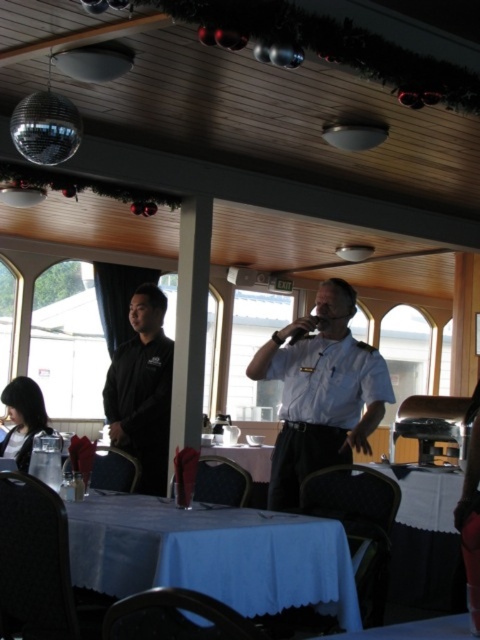
Question: Does blue fabric table at lower center appear on the left side of black smooth shirt at left?

Choices:
 (A) no
 (B) yes

Answer: (A)

Question: Which object appears farthest from the camera in this image?

Choices:
 (A) white uniform at center
 (B) black smooth shirt at left
 (C) blue fabric table at lower center

Answer: (B)

Question: Which of the following is the farthest from the observer?

Choices:
 (A) (315, 316)
 (B) (199, 592)

Answer: (A)

Question: Can you confirm if blue fabric table at lower center is smaller than white uniform at center?

Choices:
 (A) yes
 (B) no

Answer: (B)

Question: Is blue fabric table at lower center bigger than white uniform at center?

Choices:
 (A) no
 (B) yes

Answer: (B)

Question: Which object is farther from the camera taking this photo?

Choices:
 (A) black smooth shirt at left
 (B) white uniform at center

Answer: (A)